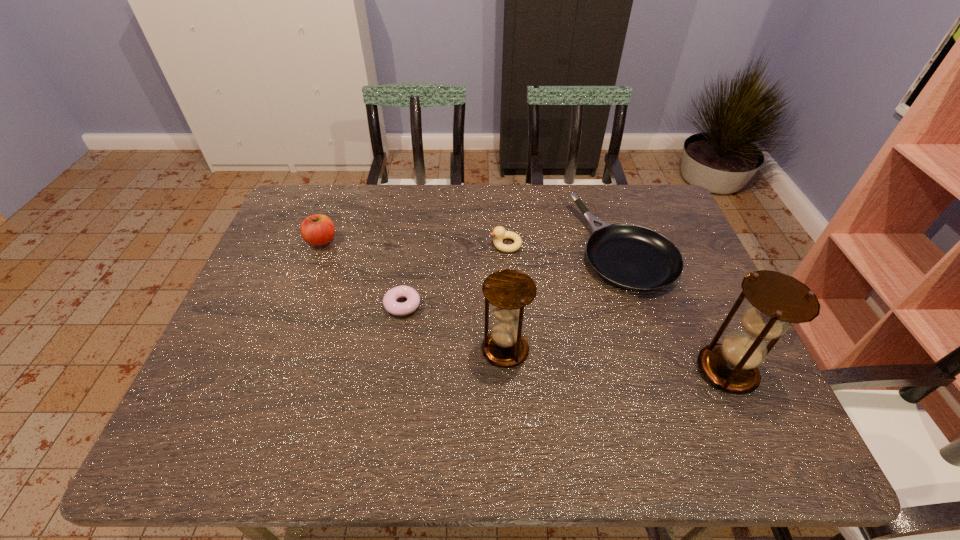
Locate an element on the screen. The height and width of the screenshot is (540, 960). vacant space positioned on the left of the second tallest object is located at coordinates (389, 350).

Where is `vacant space located on the left of the right hourglass`? This screenshot has height=540, width=960. vacant space located on the left of the right hourglass is located at coordinates (628, 370).

Image resolution: width=960 pixels, height=540 pixels. In order to click on free region located on the front of the third tallest object in this screenshot , I will do `click(294, 315)`.

Find the location of a particular element. free location located on the left of the pan is located at coordinates (491, 247).

Image resolution: width=960 pixels, height=540 pixels. Find the location of `free space located 0.080m on the front of the fifth object from right to left`. free space located 0.080m on the front of the fifth object from right to left is located at coordinates (396, 345).

Locate an element on the screen. The width and height of the screenshot is (960, 540). free space located at the beak of the duckling is located at coordinates (469, 245).

Where is `vacant space located at the beak of the duckling`? vacant space located at the beak of the duckling is located at coordinates (463, 245).

Image resolution: width=960 pixels, height=540 pixels. I want to click on free point located 0.310m at the beak of the duckling, so click(x=385, y=245).

Locate an element on the screen. Image resolution: width=960 pixels, height=540 pixels. object that is at the far edge is located at coordinates (633, 257).

Where is `object positioned at the near edge`? This screenshot has height=540, width=960. object positioned at the near edge is located at coordinates (777, 300).